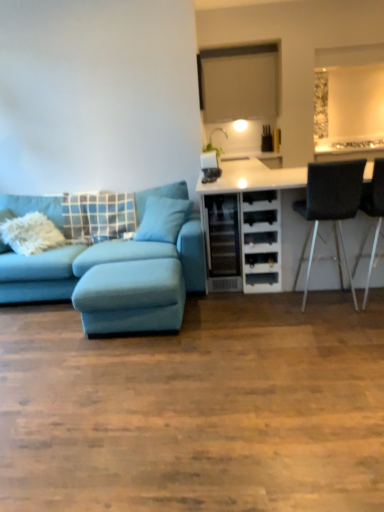
Question: From a real-world perspective, does blue fabric pillow at left, acting as the first pillow starting from the left, sit lower than black leather chair at right, which is the 2th chair in right-to-left order?

Choices:
 (A) yes
 (B) no

Answer: (B)

Question: Does blue fabric pillow at left, which is the second pillow from right to left, touch black leather chair at right, which is the 2th chair in right-to-left order?

Choices:
 (A) yes
 (B) no

Answer: (B)

Question: Is blue fabric pillow at left, acting as the first pillow starting from the left, to the left of black leather chair at right, which is the 2th chair in right-to-left order, from the viewer's perspective?

Choices:
 (A) yes
 (B) no

Answer: (A)

Question: From the image's perspective, would you say blue fabric pillow at left, acting as the first pillow starting from the left, is shown under black leather chair at right, which is the 1th chair in left-to-right order?

Choices:
 (A) yes
 (B) no

Answer: (B)

Question: Is blue fabric pillow at left, acting as the first pillow starting from the left, facing towards black leather chair at right, which is the 1th chair in left-to-right order?

Choices:
 (A) no
 (B) yes

Answer: (A)

Question: Which is correct: velvet teal couch at left is inside blue fabric pillow at left, which is the second pillow from right to left, or outside of it?

Choices:
 (A) inside
 (B) outside

Answer: (B)

Question: Considering the positions of point (41, 265) and point (81, 236), is point (41, 265) closer or farther from the camera than point (81, 236)?

Choices:
 (A) farther
 (B) closer

Answer: (B)

Question: Based on their positions, is velvet teal couch at left located to the left or right of blue fabric pillow at left, which is the second pillow from right to left?

Choices:
 (A) right
 (B) left

Answer: (B)

Question: Considering the positions of velvet teal couch at left and blue fabric pillow at left, acting as the first pillow starting from the left, in the image, is velvet teal couch at left taller or shorter than blue fabric pillow at left, acting as the first pillow starting from the left,?

Choices:
 (A) tall
 (B) short

Answer: (A)

Question: In the image, is black leather chair at right, which is the 1th chair in left-to-right order, on the left side or the right side of velvet teal couch at left?

Choices:
 (A) right
 (B) left

Answer: (A)

Question: Is point (345, 259) positioned closer to the camera than point (69, 265)?

Choices:
 (A) closer
 (B) farther

Answer: (A)

Question: Is black leather chair at right, which is the 1th chair in left-to-right order, wider or thinner than velvet teal couch at left?

Choices:
 (A) wide
 (B) thin

Answer: (B)

Question: Considering the positions of black leather chair at right, which is the 2th chair in right-to-left order, and velvet teal couch at left in the image, is black leather chair at right, which is the 2th chair in right-to-left order, taller or shorter than velvet teal couch at left?

Choices:
 (A) tall
 (B) short

Answer: (A)

Question: From the image's perspective, is white matte cabinet at right above or below teal fabric pillow at center, which is the 2th pillow in left-to-right order?

Choices:
 (A) above
 (B) below

Answer: (B)

Question: Looking at the image, does white matte cabinet at right seem bigger or smaller compared to teal fabric pillow at center, which is the 2th pillow in left-to-right order?

Choices:
 (A) small
 (B) big

Answer: (B)